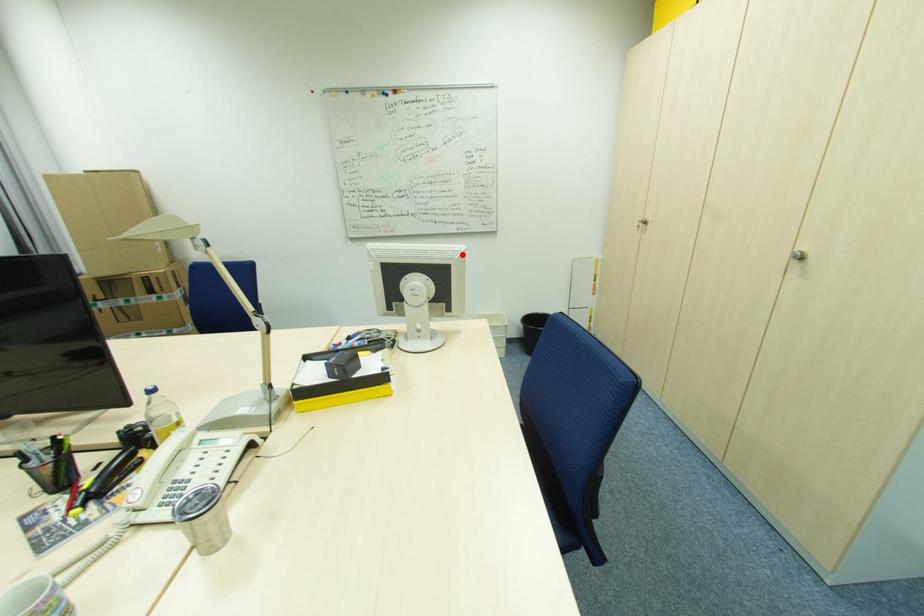
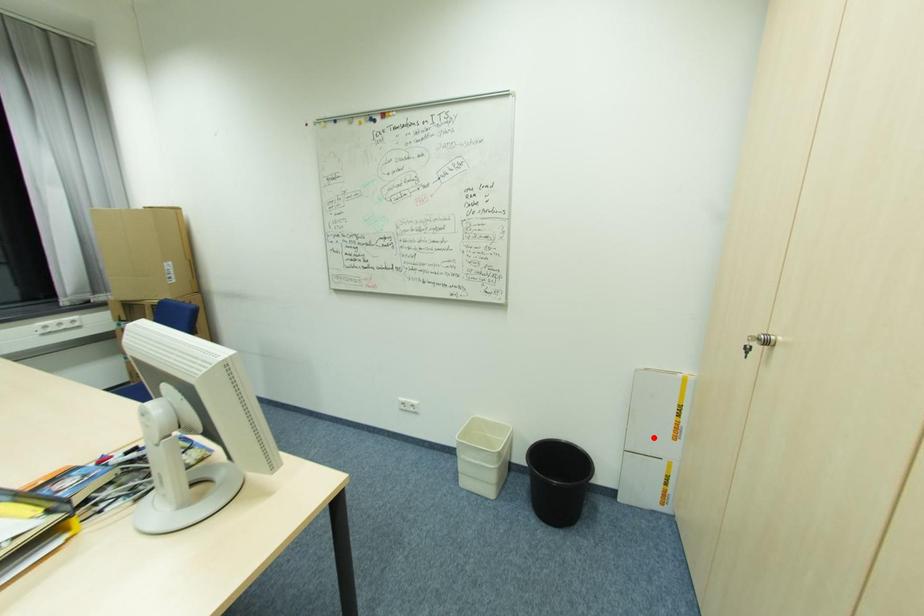
I am providing you with two images of the same scene from different viewpoints. A red point is marked on the first image and another point is marked on the second image. Is the marked point in image1 the same physical position as the marked point in image2?

No